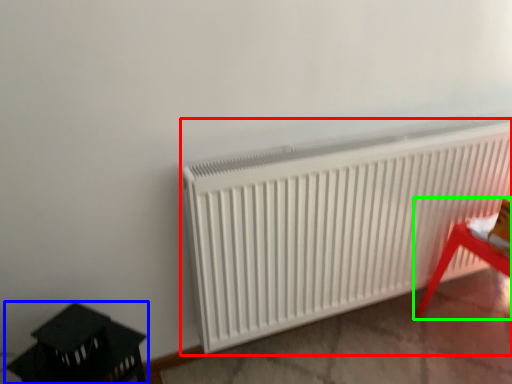
Question: Which object is positioned farthest from radiator (highlighted by a red box)? Select from furniture (highlighted by a blue box) and furniture (highlighted by a green box).

Choices:
 (A) furniture
 (B) furniture

Answer: (A)